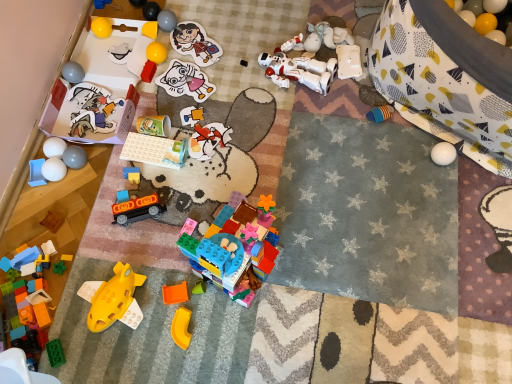
The width and height of the screenshot is (512, 384). What are the coordinates of `vacant space that's between yellow rubber ball at upper left, the fifteenth toy viewed from the left, and white matte robot at upper center, the 3th toy viewed from the right` in the screenshot? It's located at point(220,66).